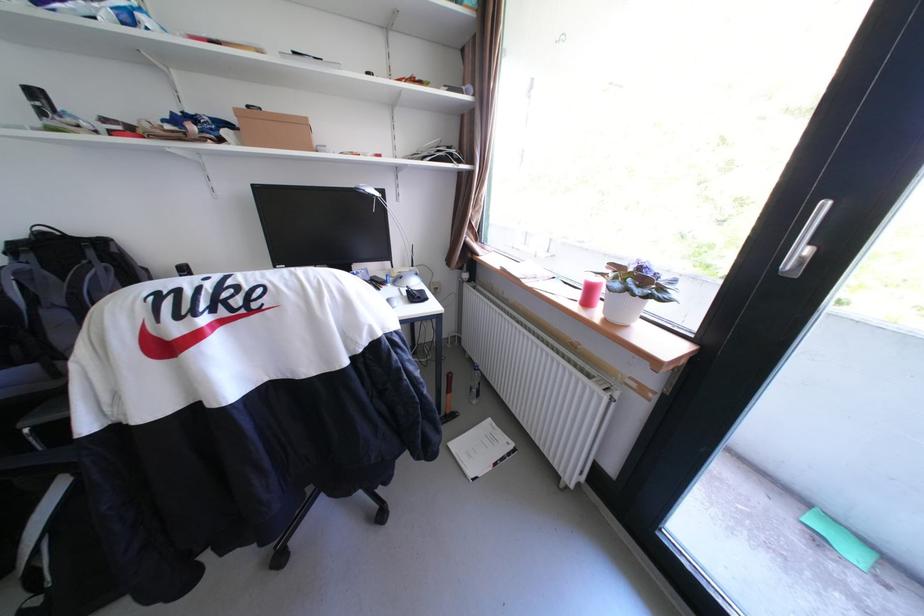
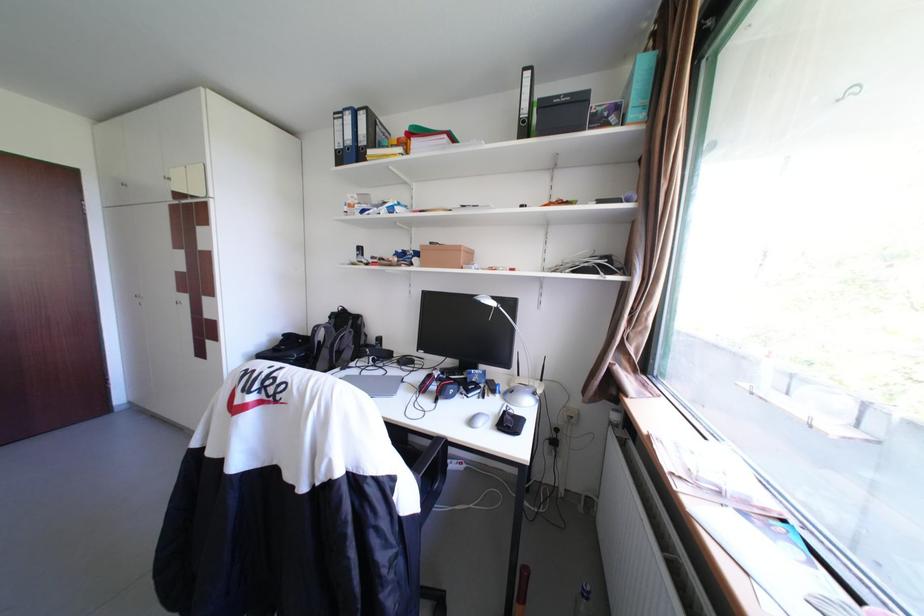
The point at (41,257) is marked in the first image. Where is the corresponding point in the second image?

(344, 321)